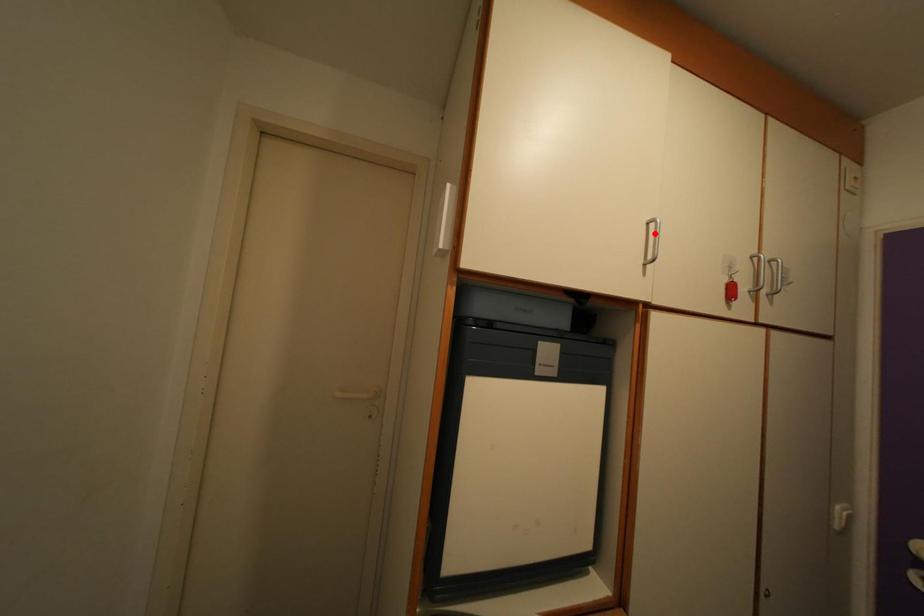
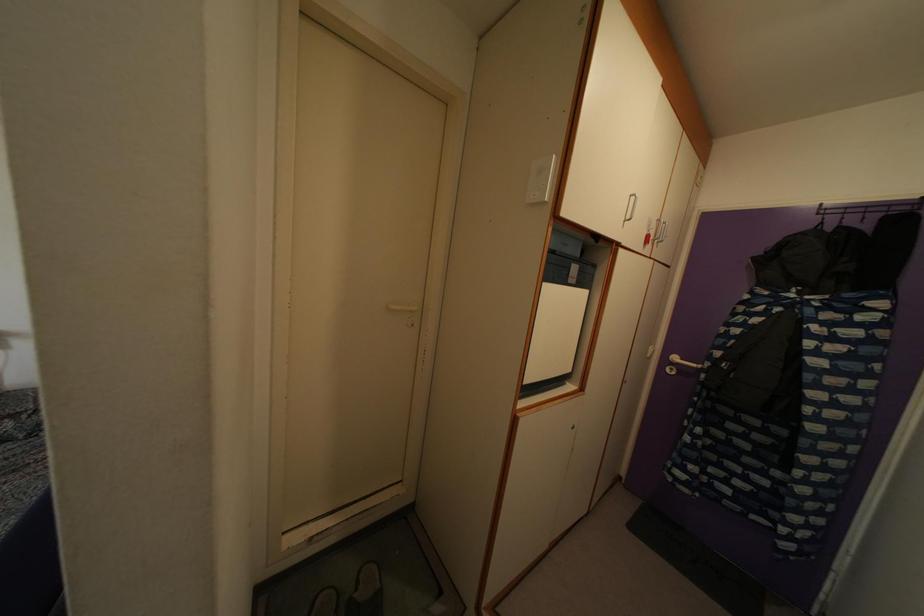
Locate, in the second image, the point that corresponds to the highlighted location in the first image.

(636, 206)